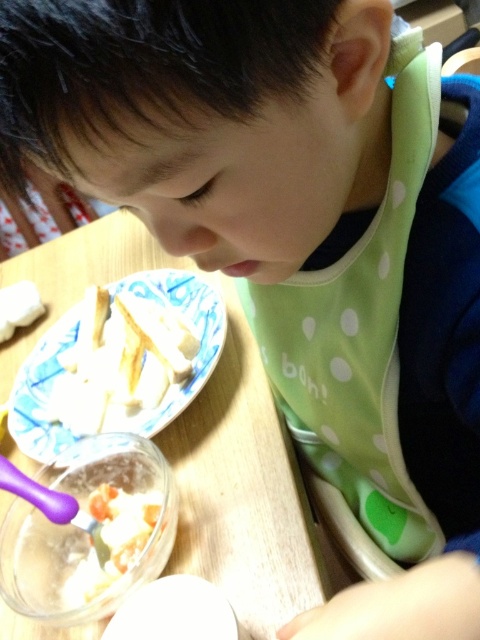
Question: Among these objects, which one is nearest to the camera?

Choices:
 (A) white creamy food at center
 (B) wooden table at center
 (C) green dotted bib at center
 (D) white glossy plate at center

Answer: (C)

Question: Is green dotted bib at center bigger than wooden table at center?

Choices:
 (A) no
 (B) yes

Answer: (A)

Question: Which of the following is the closest to the observer?

Choices:
 (A) green dotted bib at center
 (B) wooden table at center

Answer: (A)

Question: Does white glossy plate at center have a greater width compared to white creamy food at center?

Choices:
 (A) no
 (B) yes

Answer: (B)

Question: Is green dotted bib at center thinner than white creamy food at center?

Choices:
 (A) no
 (B) yes

Answer: (A)

Question: Which of the following is the farthest from the observer?

Choices:
 (A) white creamy food at center
 (B) white glossy plate at center

Answer: (B)